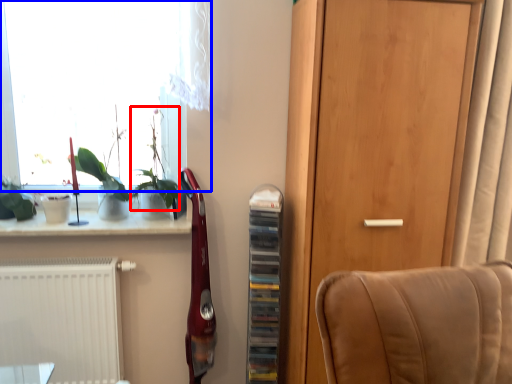
Question: Which point is further to the camera, plant (highlighted by a red box) or window (highlighted by a blue box)?

Choices:
 (A) plant
 (B) window

Answer: (B)